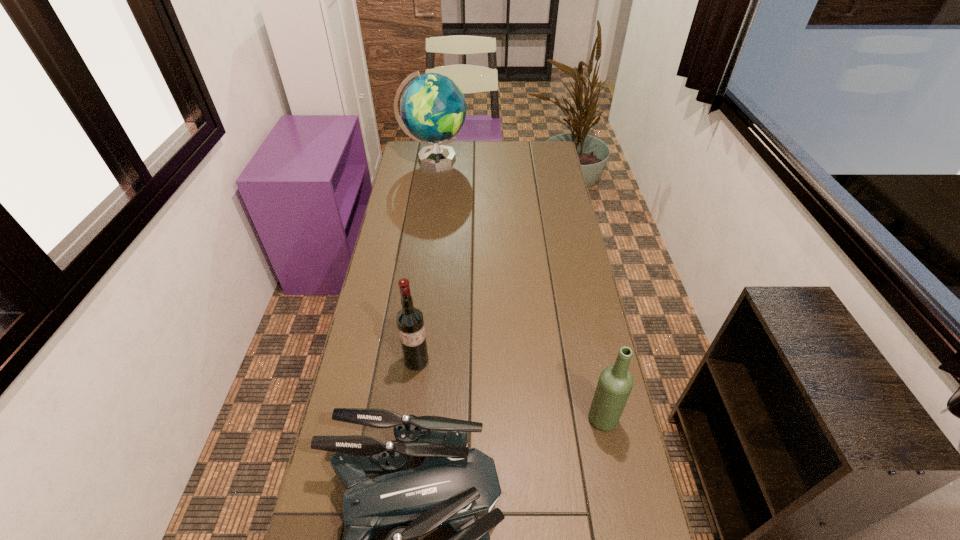
This screenshot has height=540, width=960. In order to click on empty space between the nearer wine bottle and the globe in this screenshot , I will do `click(518, 289)`.

Locate an element on the screen. Image resolution: width=960 pixels, height=540 pixels. free space between the globe and the left wine bottle is located at coordinates (425, 260).

Image resolution: width=960 pixels, height=540 pixels. What are the coordinates of `vacant region between the third nearest object and the rightmost object` in the screenshot? It's located at (510, 390).

Image resolution: width=960 pixels, height=540 pixels. In order to click on vacant space that's between the right wine bottle and the farther wine bottle in this screenshot , I will do `click(510, 390)`.

You are a GUI agent. You are given a task and a screenshot of the screen. Output one action in this format:
    pyautogui.click(x=<x>, y=<y>)
    Task: Click on the object that is the closest to the second farthest object
    The width and height of the screenshot is (960, 540).
    Given the screenshot: What is the action you would take?
    pyautogui.click(x=454, y=485)

Identify which object is the second nearest to the rightmost object. Please provide its 2D coordinates. Your answer should be formatted as a tuple, i.e. [(x, y)], where the tuple contains the x and y coordinates of a point satisfying the conditions above.

[(410, 323)]

This screenshot has width=960, height=540. I want to click on vacant area that satisfies the following two spatial constraints: 1. on the front surface of the globe; 2. on the back side of the right wine bottle, so click(397, 420).

What are the coordinates of `free space that satisfies the following two spatial constraints: 1. on the front and back of the rightmost object; 2. on the left side of the farther wine bottle` in the screenshot? It's located at (410, 420).

This screenshot has width=960, height=540. What are the coordinates of `free space that satisfies the following two spatial constraints: 1. on the front and back of the right wine bottle; 2. on the left side of the left wine bottle` in the screenshot? It's located at (410, 420).

Locate an element on the screen. vacant area in the image that satisfies the following two spatial constraints: 1. on the front and back of the second farthest object; 2. on the right side of the nearer wine bottle is located at coordinates (410, 420).